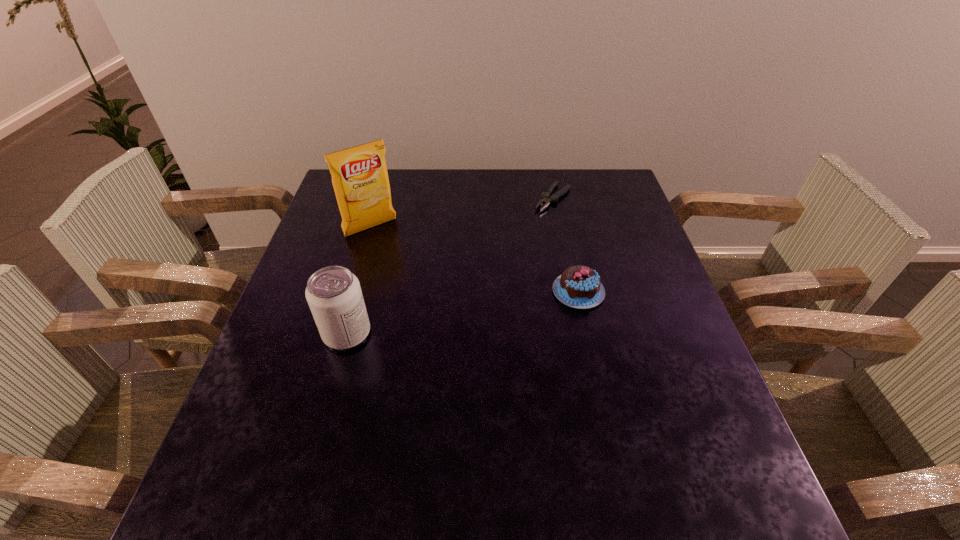
At what (x,y) coordinates should I click in order to perform the action: click on vacant area at the far edge. Please return your answer as a coordinate pair (x, y). Looking at the image, I should click on (401, 190).

This screenshot has width=960, height=540. What are the coordinates of `vacant space at the near edge of the desktop` in the screenshot? It's located at click(588, 456).

Where is `blank area at the left edge`? This screenshot has height=540, width=960. blank area at the left edge is located at coordinates (292, 374).

This screenshot has height=540, width=960. I want to click on vacant space at the right edge, so click(x=667, y=364).

The image size is (960, 540). In the image, there is a desktop. What are the coordinates of `vacant space at the near left corner` in the screenshot? It's located at (296, 447).

Locate an element on the screen. vacant space at the far right corner of the desktop is located at coordinates (589, 180).

Image resolution: width=960 pixels, height=540 pixels. I want to click on free spot between the farthest object and the chocolate cake, so click(x=565, y=245).

Locate an element on the screen. Image resolution: width=960 pixels, height=540 pixels. vacant region between the shortest object and the crisp (potato chip) is located at coordinates (462, 213).

The width and height of the screenshot is (960, 540). What are the coordinates of `unoccupied area between the second nearest object and the shortest object` in the screenshot? It's located at (565, 245).

The image size is (960, 540). I want to click on free spot between the soda can and the shortest object, so click(450, 266).